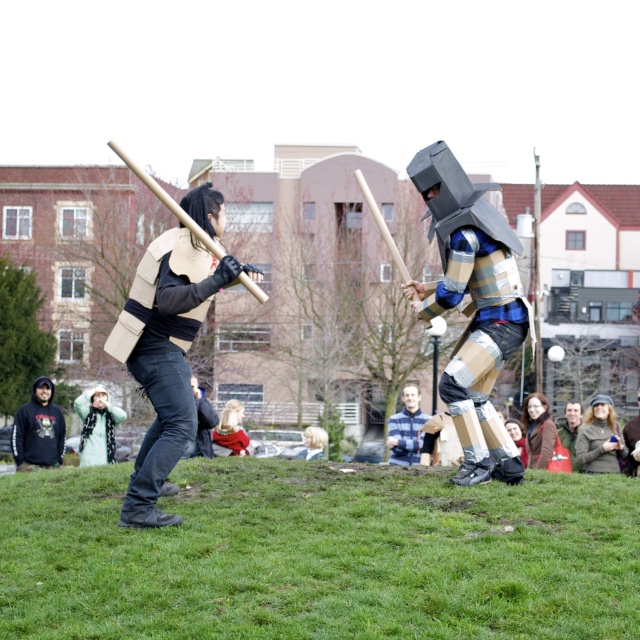
You are a photographer trying to capture a photo of the blue plaid shirt at center without the green woolen hat at lower right blocking it. What should you do?

Move the camera to the left so that the blue plaid shirt at center is no longer behind the green woolen hat at lower right.

You are a photographer trying to capture the matte cardboard vest at left and the dark gray hoodie at lower left in a single frame. Based on their positions, which object should you focus on first to ensure both are in the shot?

The matte cardboard vest at left is above the dark gray hoodie at lower left, so focusing on the matte cardboard vest at left first would help ensure both are in the frame as it is positioned higher up.

You are standing at the camera position and want to pick up the green woolen hat at lower right. Is it within a 50 feet distance?

The green woolen hat at lower right is 57.58 feet away from the camera, so it is beyond the 50 feet distance and cannot be reached.